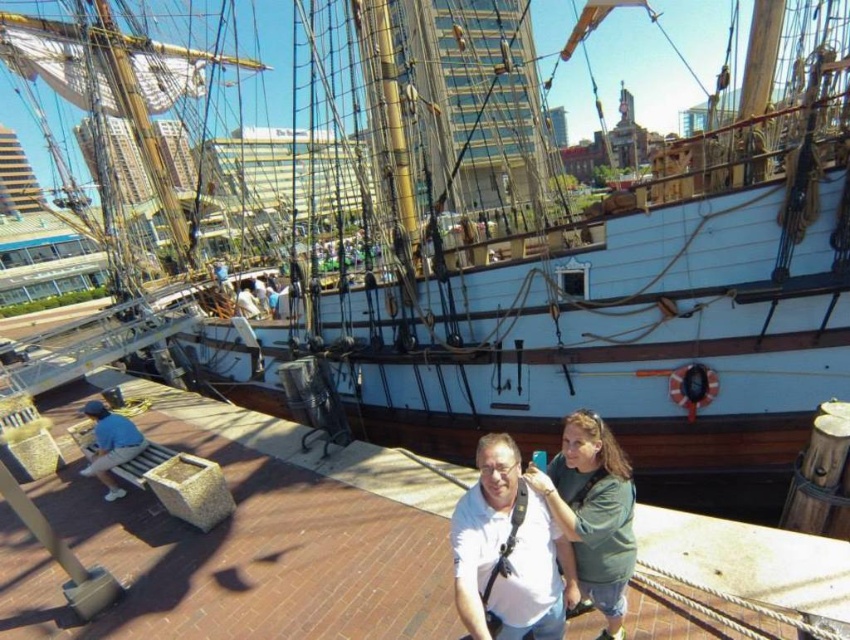
You are a photographer trying to capture a group photo of the two people at the dock. The camera you are using has a limited frame width. Given that the white matte shirt at center is wider than the green matte shirt at center, which person should be positioned closer to the center of the frame to ensure both fit comfortably within the camera frame?

The white matte shirt at center is wider than the green matte shirt at center. To ensure both fit comfortably within the camera frame, the person wearing the white matte shirt at center should be positioned closer to the center of the frame, allowing space for their wider width while keeping the green matte shirt at center slightly to the side.

You are a photographer trying to capture the two people in the scene. Which person should you focus on first if you want to follow the rule of thirds? The rule of thirds suggests focusing on the subject that is closer to the bottom third of the frame. The options are the white matte shirt at center and the green matte shirt at center.

The white matte shirt at center is below the green matte shirt at center, so you should focus on the white matte shirt at center first as it is closer to the bottom third of the frame according to the rule of thirds.

You are a photographer trying to capture a clear shot of both the white matte shirt at center and the green matte shirt at center. Based on their positions, which one is blocking the view of the other?

The white matte shirt at center is in front of the green matte shirt at center, so it is blocking the view of the green matte shirt at center.